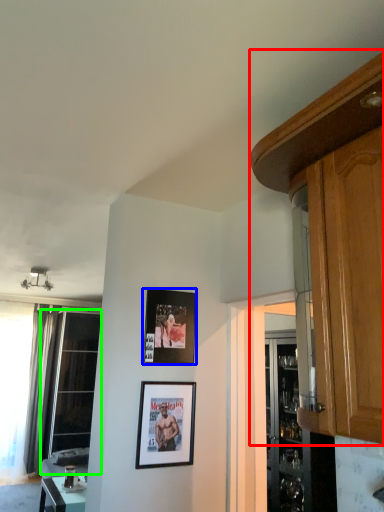
Question: Which object is the farthest from cabinetry (highlighted by a red box)? Choose among these: picture frame (highlighted by a blue box) or window (highlighted by a green box).

Choices:
 (A) picture frame
 (B) window

Answer: (B)